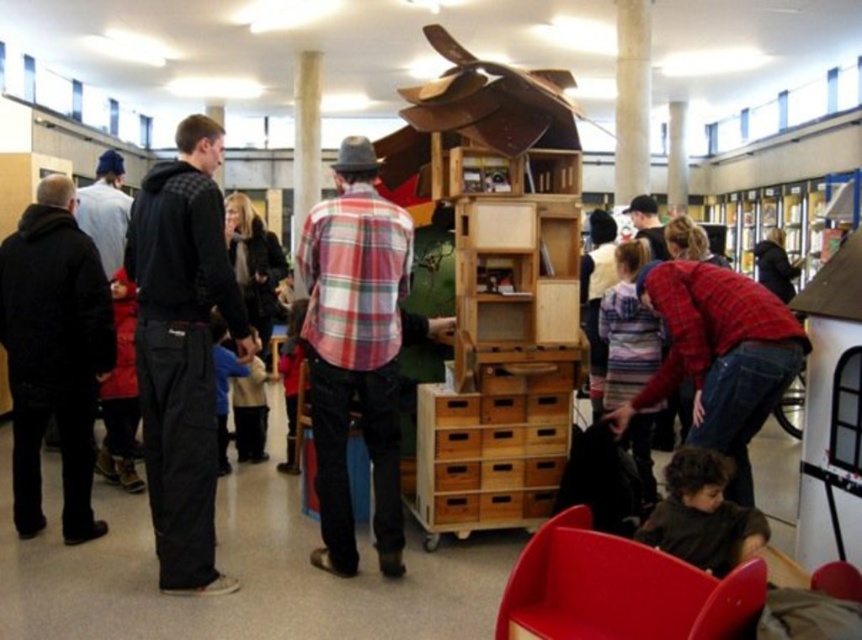
Question: Is plaid fabric shirt at center thinner than black matte jacket at left?

Choices:
 (A) no
 (B) yes

Answer: (A)

Question: Does black matte pants at left appear on the left side of matte red chair at lower right?

Choices:
 (A) no
 (B) yes

Answer: (B)

Question: Which is farther from the plaid fabric shirt at center?

Choices:
 (A) black matte jacket at left
 (B) black matte pants at left

Answer: (A)

Question: Is black matte pants at left below matte red chair at lower right?

Choices:
 (A) yes
 (B) no

Answer: (B)

Question: Which object appears farthest from the camera in this image?

Choices:
 (A) black matte pants at left
 (B) plaid fabric shirt at center
 (C) matte red chair at lower right
 (D) black matte jacket at left

Answer: (D)

Question: Which object is positioned farthest from the plaid fabric shirt at center?

Choices:
 (A) matte red chair at lower right
 (B) black matte jacket at left

Answer: (A)